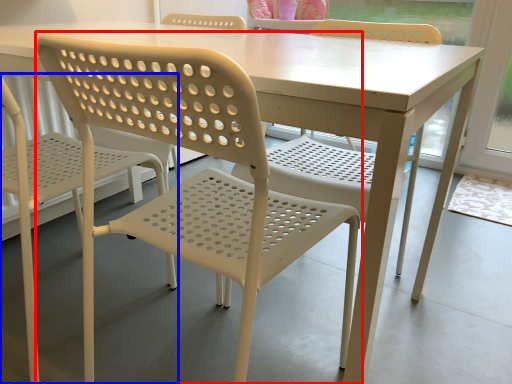
Question: Which point is closer to the camera, chair (highlighted by a red box) or chair (highlighted by a blue box)?

Choices:
 (A) chair
 (B) chair

Answer: (A)